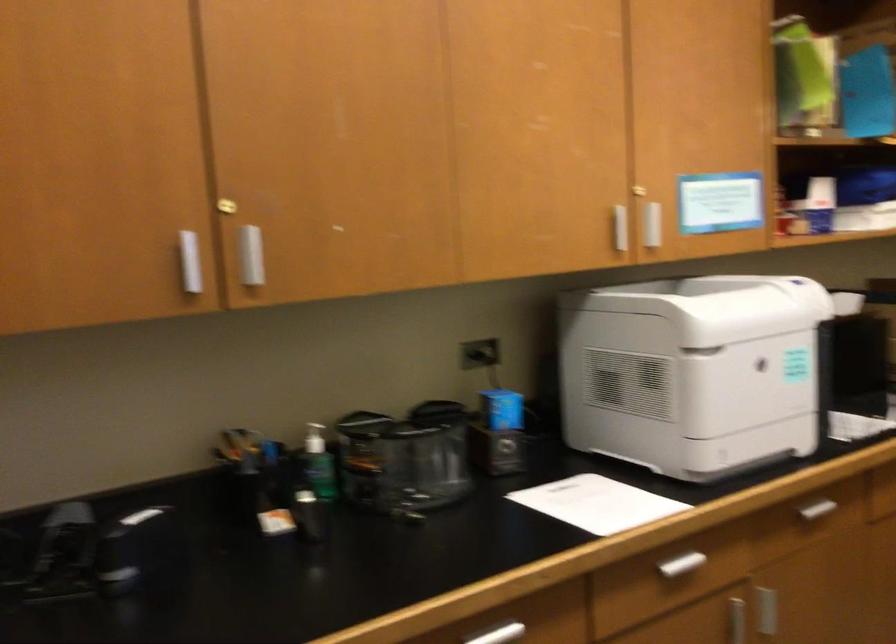
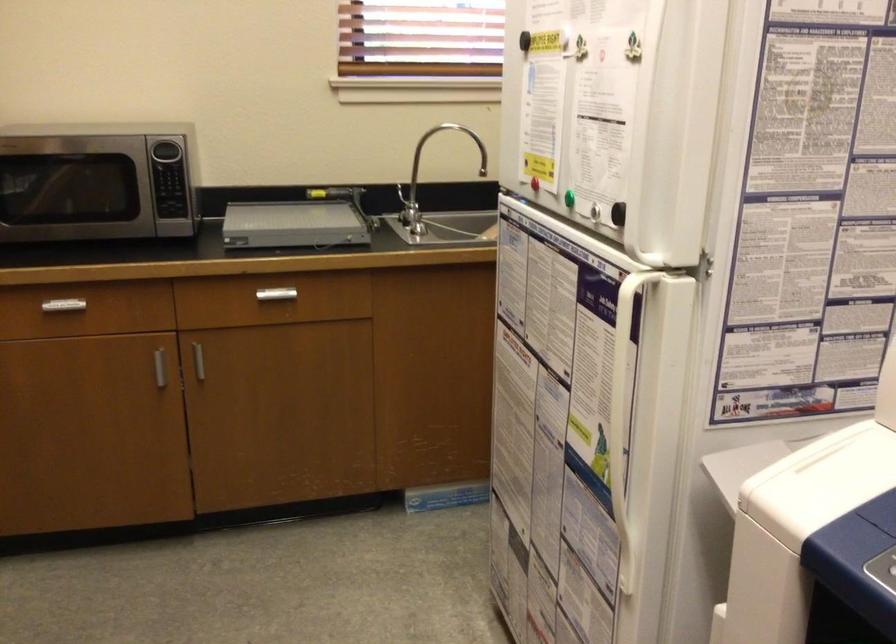
Question: The camera is either moving clockwise (left) or counter-clockwise (right) around the object. The first image is from the beginning of the video and the second image is from the end. Is the camera moving left or right when shooting the video?

Choices:
 (A) Left
 (B) Right

Answer: (A)